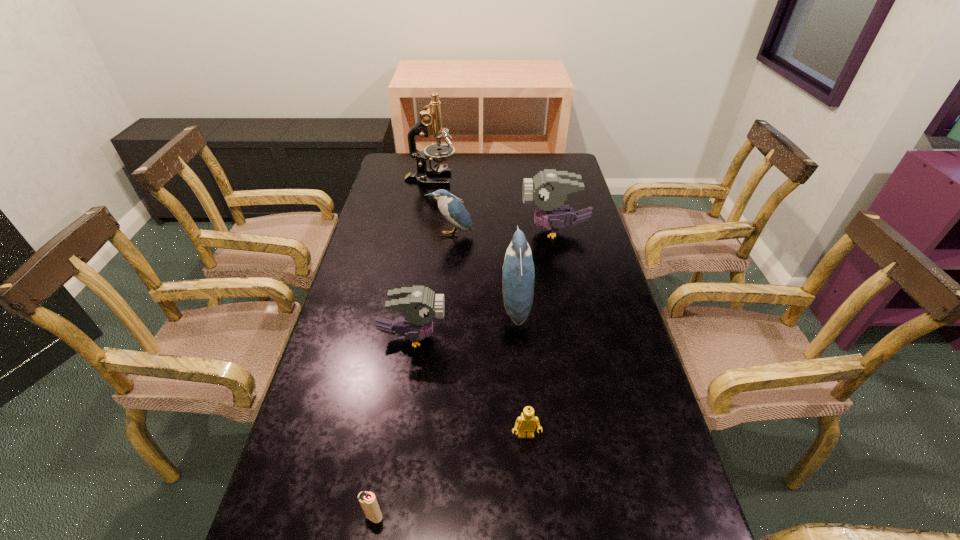
Identify the location of vacant space located at the tip of the farther blue bird's beak. The image size is (960, 540). (449, 249).

Locate an element on the screen. The height and width of the screenshot is (540, 960). vacant region located 0.290m at the beak of the smaller gray bird is located at coordinates (553, 338).

Find the location of a particular element. The image size is (960, 540). free space located 0.060m on the face of the sixth farthest object is located at coordinates pos(529,470).

The height and width of the screenshot is (540, 960). I want to click on vacant area situated 0.320m on the right of the red igniter, so click(547, 516).

What are the coordinates of `object that is at the far edge` in the screenshot? It's located at (430, 122).

Locate an element on the screen. microscope present at the left edge is located at coordinates (430, 122).

At what (x,y) coordinates should I click in order to perform the action: click on bird positioned at the left edge. Please return your answer as a coordinate pair (x, y). The image size is (960, 540). Looking at the image, I should click on coord(419,305).

Locate an element on the screen. object that is at the right edge is located at coordinates (549, 188).

This screenshot has height=540, width=960. What are the coordinates of `object that is at the far left corner` in the screenshot? It's located at (430, 122).

Find the location of `free space at the far edge of the desktop`. free space at the far edge of the desktop is located at coordinates (536, 168).